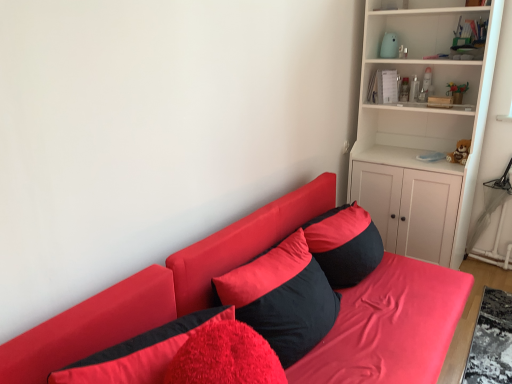
Question: From the image's perspective, is black matte pillow at center, acting as the 1th pillow starting from the back, over brown plush bear at upper right?

Choices:
 (A) no
 (B) yes

Answer: (A)

Question: Can you confirm if black matte pillow at center, which is the 3th pillow from front to back, is thinner than brown plush bear at upper right?

Choices:
 (A) yes
 (B) no

Answer: (B)

Question: Is black matte pillow at center, which is the 3th pillow from front to back, taller than brown plush bear at upper right?

Choices:
 (A) yes
 (B) no

Answer: (A)

Question: Does black matte pillow at center, which is the 3th pillow from front to back, have a greater width compared to brown plush bear at upper right?

Choices:
 (A) no
 (B) yes

Answer: (B)

Question: Does black matte pillow at center, which is the 3th pillow from front to back, contain brown plush bear at upper right?

Choices:
 (A) yes
 (B) no

Answer: (B)

Question: Could you tell me if black matte pillow at center, which is the 3th pillow from front to back, is facing brown plush bear at upper right?

Choices:
 (A) yes
 (B) no

Answer: (B)

Question: Could you tell me if black matte pillow at center, which is the 3th pillow from front to back, is facing white matte cabinet at upper right?

Choices:
 (A) no
 (B) yes

Answer: (A)

Question: Does black matte pillow at center, acting as the 1th pillow starting from the back, have a larger size compared to white matte cabinet at upper right?

Choices:
 (A) no
 (B) yes

Answer: (A)

Question: Can you confirm if black matte pillow at center, which is the 3th pillow from front to back, is wider than white matte cabinet at upper right?

Choices:
 (A) yes
 (B) no

Answer: (B)

Question: Is black matte pillow at center, acting as the 1th pillow starting from the back, behind white matte cabinet at upper right?

Choices:
 (A) yes
 (B) no

Answer: (B)

Question: Is black matte pillow at center, which is the 3th pillow from front to back, at the left side of white matte cabinet at upper right?

Choices:
 (A) yes
 (B) no

Answer: (A)

Question: Are black matte pillow at center, acting as the 1th pillow starting from the back, and white matte cabinet at upper right located far from each other?

Choices:
 (A) no
 (B) yes

Answer: (A)

Question: Considering the relative sizes of matte red couch at center and velvet red pillow at lower left, acting as the 3th pillow starting from the back, in the image provided, is matte red couch at center wider than velvet red pillow at lower left, acting as the 3th pillow starting from the back,?

Choices:
 (A) yes
 (B) no

Answer: (A)